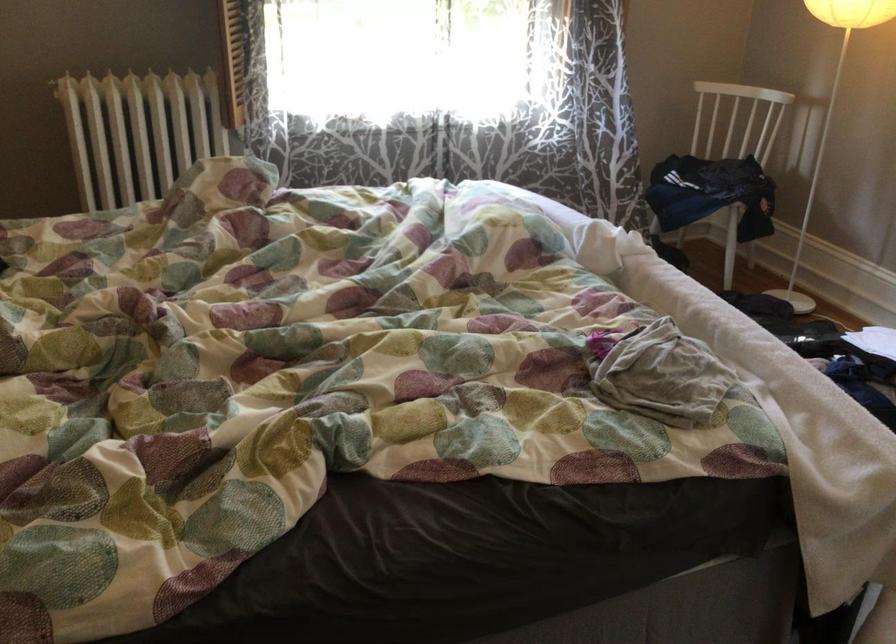
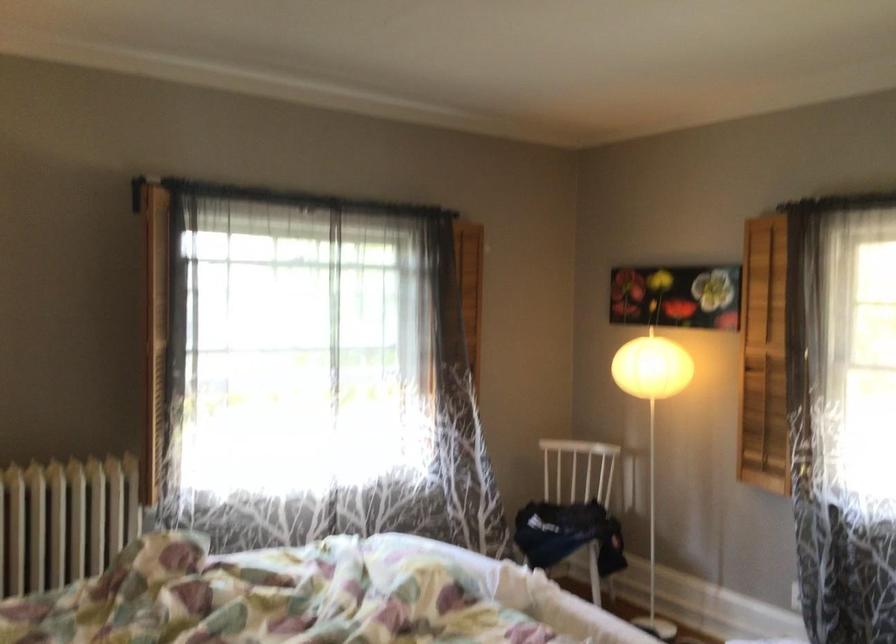
In a continuous first-person perspective shot, in which direction is the camera moving?

The cameraman walked toward left, backward.